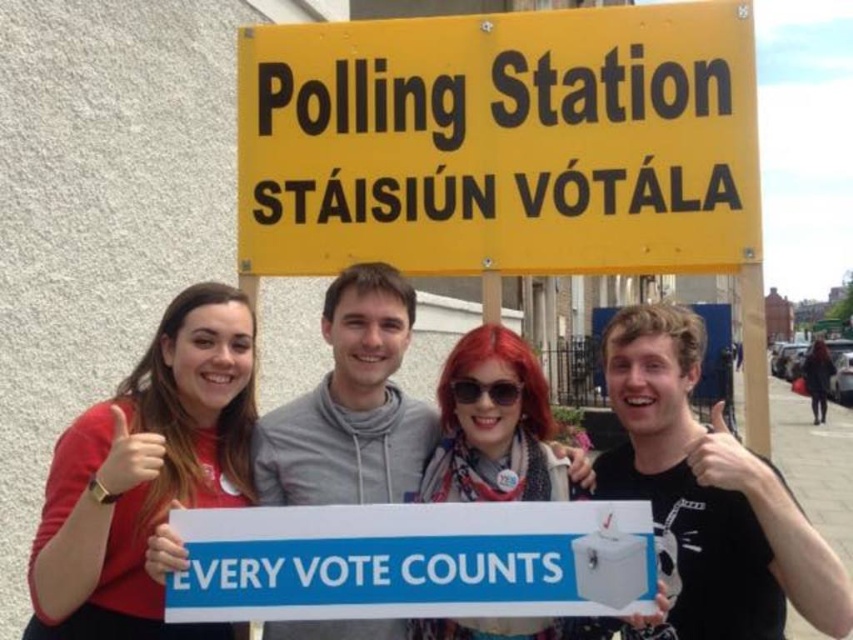
Question: Which object is the closest to the white paper sign at center?

Choices:
 (A) yellow plastic sign at upper center
 (B) black matte sign at upper center
 (C) matte red shirt at left

Answer: (C)

Question: Which point is farther to the camera?

Choices:
 (A) yellow plastic sign at upper center
 (B) matte red shirt at left
 (C) white paper sign at center

Answer: (A)

Question: Observing the image, what is the correct spatial positioning of matte red shirt at left in reference to black matte sign at upper center?

Choices:
 (A) above
 (B) below

Answer: (A)

Question: Does yellow plastic sign at upper center have a greater width compared to matte red shirt at left?

Choices:
 (A) yes
 (B) no

Answer: (A)

Question: Which of the following is the farthest from the observer?

Choices:
 (A) (637, 26)
 (B) (109, 630)

Answer: (A)

Question: Can you confirm if yellow plastic sign at upper center is smaller than matte red shirt at left?

Choices:
 (A) yes
 (B) no

Answer: (B)